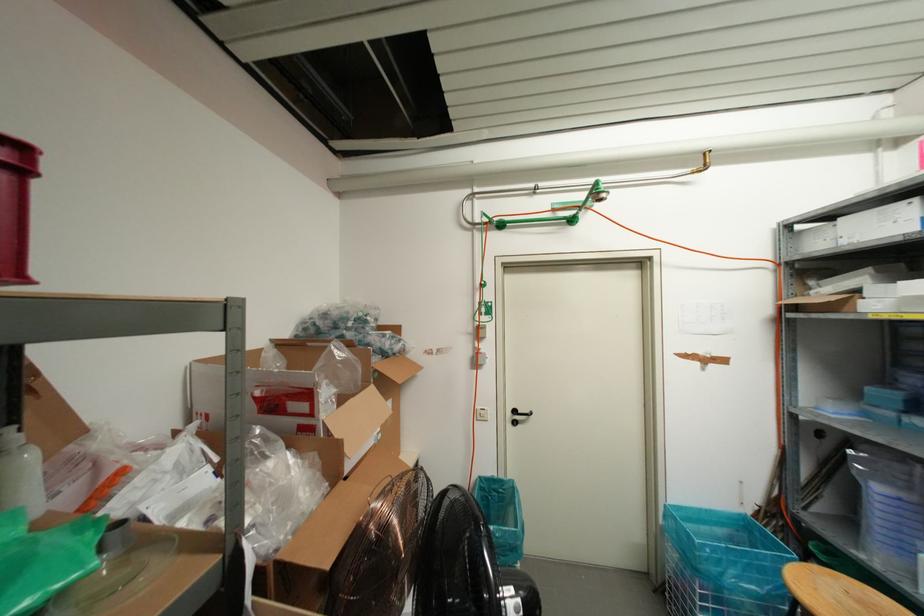
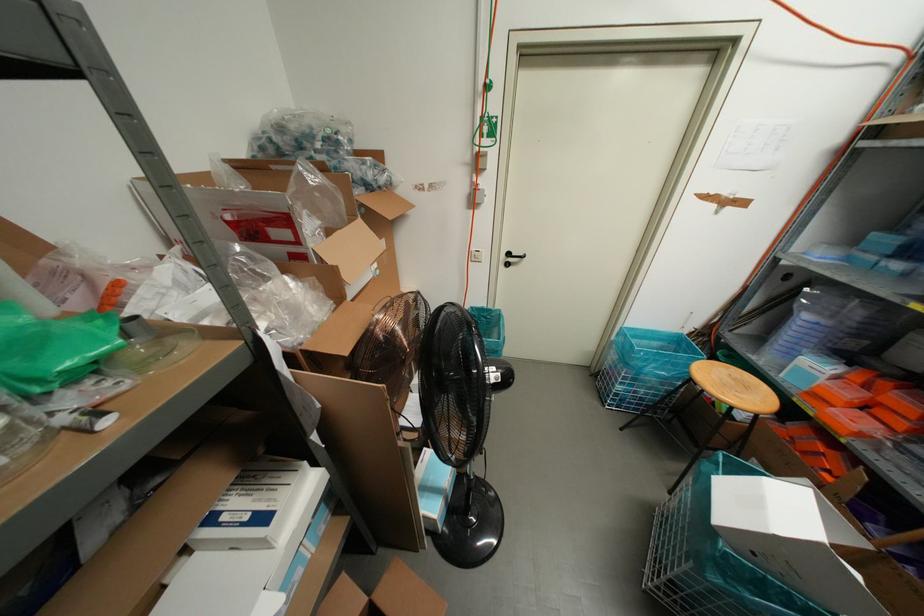
Find the pixel in the second image that matches point (476, 416) in the first image.

(470, 257)